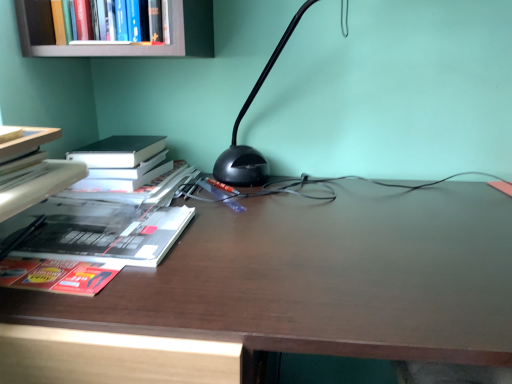
What are the coordinates of `vacant area situated below black plastic lamp at center (from a real-world perspective)` in the screenshot? It's located at (281, 197).